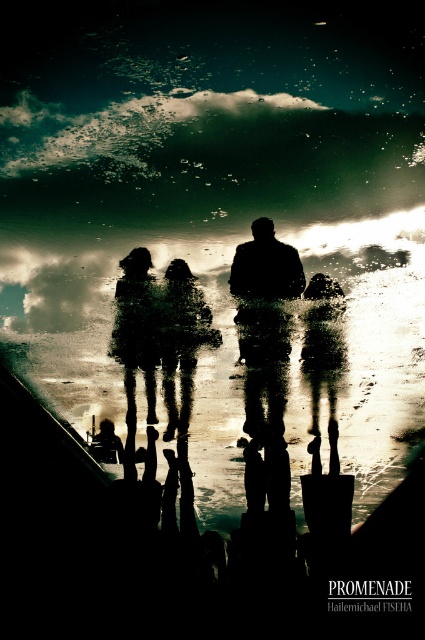
Question: Which of the following is the closest to the observer?

Choices:
 (A) (115, 340)
 (B) (303, 353)

Answer: (A)

Question: Which of the following is the closest to the observer?

Choices:
 (A) matte black figure at center
 (B) matte black pants at center

Answer: (A)

Question: Which of these objects is positioned farthest from the matte black pants at center?

Choices:
 (A) silhouette figure at center
 (B) matte black figure at center

Answer: (A)

Question: Does matte black figure at center have a lesser width compared to silhouette figure at center?

Choices:
 (A) no
 (B) yes

Answer: (A)

Question: From the image, what is the correct spatial relationship of matte black figure at center in relation to matte black pants at center?

Choices:
 (A) above
 (B) below

Answer: (B)

Question: From the image, what is the correct spatial relationship of matte black figure at center in relation to silhouette figure at center?

Choices:
 (A) left
 (B) right

Answer: (B)